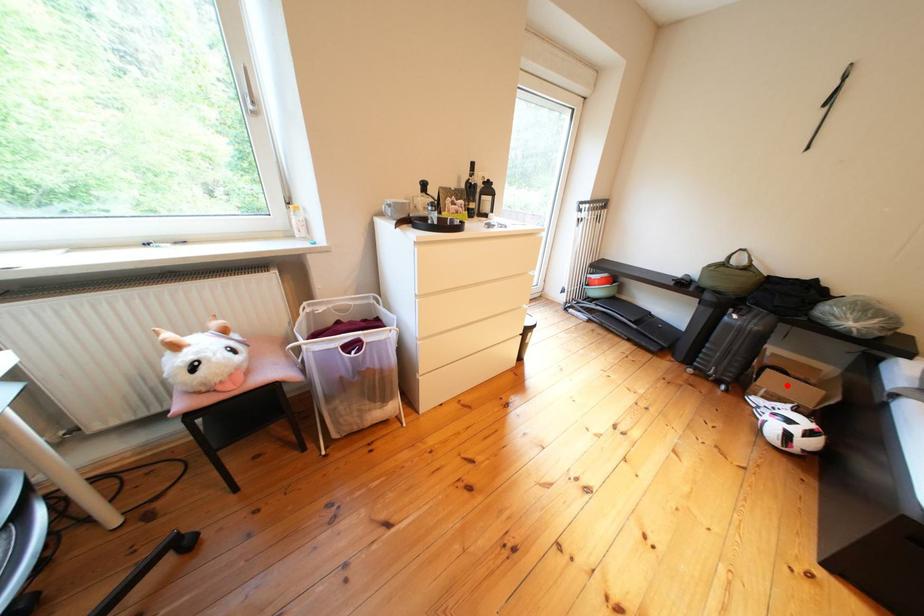
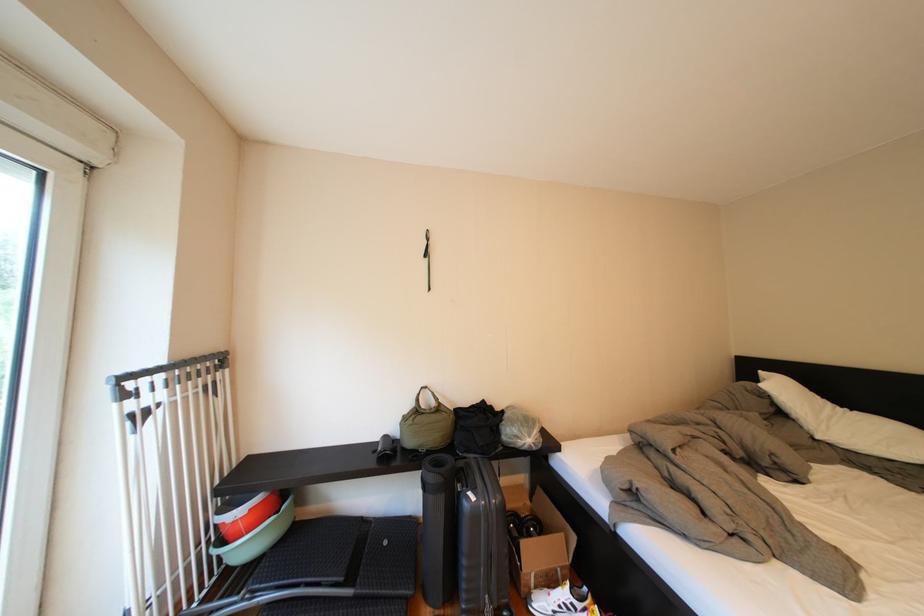
Find the pixel in the second image that matches the highlighted location in the first image.

(544, 557)